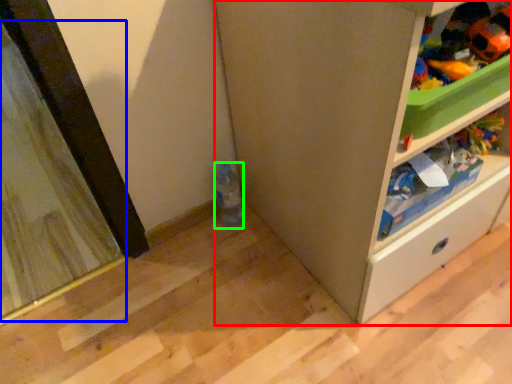
Question: Based on their relative distances, which object is farther from cabinetry (highlighted by a red box)? Choose from screen door (highlighted by a blue box) and bottle (highlighted by a green box).

Choices:
 (A) screen door
 (B) bottle

Answer: (A)